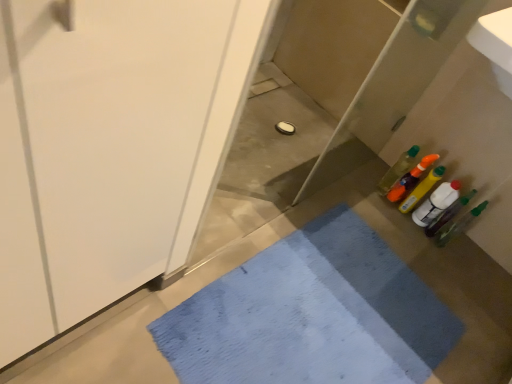
Question: Is translucent plastic bottle at right, the third bottle from the left, located within translucent plastic bottles at right, which is the first bottle in left-to-right order?

Choices:
 (A) yes
 (B) no

Answer: (B)

Question: Can you confirm if translucent plastic bottles at right, which is the sixth bottle from right to left, is shorter than translucent plastic bottle at right, the third bottle from the left?

Choices:
 (A) yes
 (B) no

Answer: (B)

Question: Is translucent plastic bottles at right, which is the first bottle in left-to-right order, oriented towards translucent plastic bottle at right, the fourth bottle viewed from the right?

Choices:
 (A) no
 (B) yes

Answer: (A)

Question: Are translucent plastic bottles at right, which is the sixth bottle from right to left, and translucent plastic bottle at right, the fourth bottle viewed from the right, located far from each other?

Choices:
 (A) no
 (B) yes

Answer: (A)

Question: Is translucent plastic bottle at right, the fourth bottle viewed from the right, at the back of translucent plastic bottles at right, which is the sixth bottle from right to left?

Choices:
 (A) yes
 (B) no

Answer: (B)

Question: Considering the positions of translucent plastic bottle at right, the 1th bottle from the right, and translucent plastic bottle at right, the fourth bottle viewed from the right, in the image, is translucent plastic bottle at right, the 1th bottle from the right, bigger or smaller than translucent plastic bottle at right, the fourth bottle viewed from the right,?

Choices:
 (A) big
 (B) small

Answer: (A)

Question: From a real-world perspective, is translucent plastic bottle at right, marked as the sixth bottle in a left-to-right arrangement, physically located above or below translucent plastic bottle at right, the fourth bottle viewed from the right?

Choices:
 (A) below
 (B) above

Answer: (B)

Question: Would you say translucent plastic bottle at right, marked as the sixth bottle in a left-to-right arrangement, is to the left or to the right of translucent plastic bottle at right, the third bottle from the left, in the picture?

Choices:
 (A) left
 (B) right

Answer: (B)

Question: Considering their positions, is translucent plastic bottle at right, marked as the sixth bottle in a left-to-right arrangement, located in front of or behind translucent plastic bottle at right, the third bottle from the left?

Choices:
 (A) behind
 (B) front

Answer: (B)

Question: From the image's perspective, relative to translucent plastic bottles at right, which is the sixth bottle from right to left, is translucent orange bottle at right, acting as the 2th bottle starting from the left, above or below?

Choices:
 (A) below
 (B) above

Answer: (A)

Question: Based on their sizes in the image, would you say translucent orange bottle at right, acting as the 2th bottle starting from the left, is bigger or smaller than translucent plastic bottles at right, which is the sixth bottle from right to left?

Choices:
 (A) big
 (B) small

Answer: (A)

Question: Considering the positions of translucent orange bottle at right, placed as the fifth bottle when sorted from right to left, and translucent plastic bottles at right, which is the first bottle in left-to-right order, in the image, is translucent orange bottle at right, placed as the fifth bottle when sorted from right to left, wider or thinner than translucent plastic bottles at right, which is the first bottle in left-to-right order,?

Choices:
 (A) wide
 (B) thin

Answer: (A)

Question: Is translucent orange bottle at right, placed as the fifth bottle when sorted from right to left, in front of or behind translucent plastic bottles at right, which is the sixth bottle from right to left, in the image?

Choices:
 (A) behind
 (B) front

Answer: (B)

Question: From a real-world perspective, relative to translucent plastic bottle at right, the fourth bottle in the left-to-right sequence, is translucent orange bottle at right, placed as the fifth bottle when sorted from right to left, vertically above or below?

Choices:
 (A) above
 (B) below

Answer: (A)

Question: Considering the relative positions of translucent orange bottle at right, acting as the 2th bottle starting from the left, and translucent plastic bottle at right, the third bottle in the right-to-left sequence, in the image provided, is translucent orange bottle at right, acting as the 2th bottle starting from the left, to the left or to the right of translucent plastic bottle at right, the third bottle in the right-to-left sequence,?

Choices:
 (A) left
 (B) right

Answer: (A)